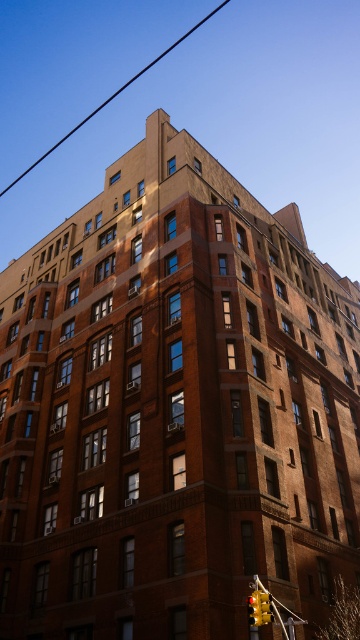
Question: Which point is closer to the camera taking this photo?

Choices:
 (A) (263, 608)
 (B) (30, 166)

Answer: (A)

Question: Is the position of metallic wire at upper center more distant than that of yellow matte traffic light at lower right?

Choices:
 (A) no
 (B) yes

Answer: (B)

Question: Does metallic wire at upper center lie in front of yellow matte traffic light at lower right?

Choices:
 (A) no
 (B) yes

Answer: (A)

Question: Can you confirm if metallic wire at upper center is wider than yellow matte traffic light at lower right?

Choices:
 (A) yes
 (B) no

Answer: (A)

Question: Which point is farther to the camera?

Choices:
 (A) yellow matte traffic light at lower right
 (B) metallic wire at upper center

Answer: (B)